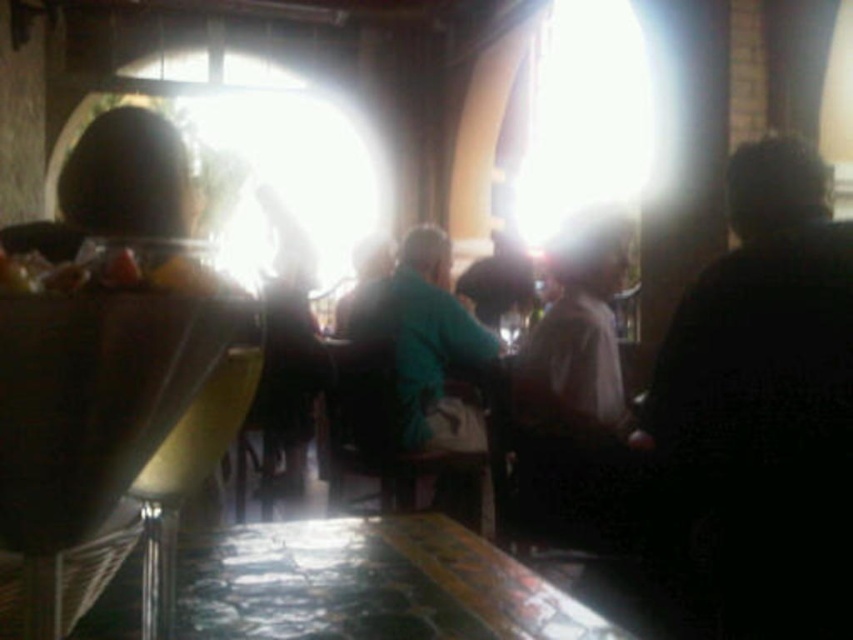
You are a delivery person who needs to place a small package on the metallic reflective table at lower center. However, there is a shiny plastic bag of chips at left nearby. Can you place the package on the table without knocking over the chips?

The metallic reflective table at lower center is taller than the shiny plastic bag of chips at left, so placing the package on the table won me should not affect the chips as they are lower and further away.

You are standing in the dimly lit establishment and want to place a large tray on the metallic reflective table at lower center. Considering the table is at coordinates 0.914, 0.433, can you estimate its position relative to the room?

The metallic reflective table at lower center is located at coordinates (x=368, y=584), which places it near the lower right portion of the room.